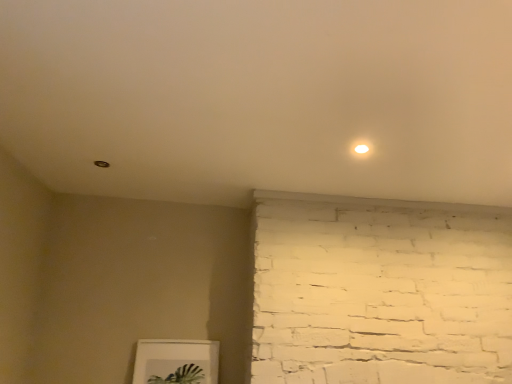
Question: Does white matte light at upper right come behind white matte picture frame at lower center?

Choices:
 (A) yes
 (B) no

Answer: (B)

Question: Is white matte light at upper right to the right of white matte picture frame at lower center from the viewer's perspective?

Choices:
 (A) yes
 (B) no

Answer: (A)

Question: Is white matte light at upper right outside white matte picture frame at lower center?

Choices:
 (A) yes
 (B) no

Answer: (A)

Question: Does white matte light at upper right have a lesser height compared to white matte picture frame at lower center?

Choices:
 (A) no
 (B) yes

Answer: (B)

Question: From the image's perspective, is white matte light at upper right beneath white matte picture frame at lower center?

Choices:
 (A) no
 (B) yes

Answer: (A)

Question: Is the depth of white matte light at upper right less than that of white matte picture frame at lower center?

Choices:
 (A) no
 (B) yes

Answer: (B)

Question: Is the position of white matte picture frame at lower center less distant than that of white matte light at upper right?

Choices:
 (A) no
 (B) yes

Answer: (A)

Question: Is white matte picture frame at lower center turned away from white matte light at upper right?

Choices:
 (A) yes
 (B) no

Answer: (B)

Question: Is white matte picture frame at lower center shorter than white matte light at upper right?

Choices:
 (A) yes
 (B) no

Answer: (B)

Question: Is white matte picture frame at lower center to the right of white matte light at upper right from the viewer's perspective?

Choices:
 (A) no
 (B) yes

Answer: (A)

Question: Is white matte picture frame at lower center positioned behind white matte light at upper right?

Choices:
 (A) yes
 (B) no

Answer: (A)

Question: Is white matte picture frame at lower center smaller than white matte light at upper right?

Choices:
 (A) no
 (B) yes

Answer: (A)

Question: Does point (195, 340) appear closer or farther from the camera than point (354, 150)?

Choices:
 (A) closer
 (B) farther

Answer: (B)